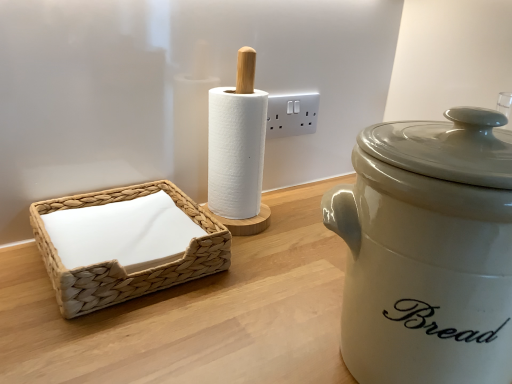
Question: In the image, is woven beige basket at left positioned in front of or behind white plastic electric outlet at upper center?

Choices:
 (A) front
 (B) behind

Answer: (A)

Question: In terms of height, does woven beige basket at left look taller or shorter compared to white plastic electric outlet at upper center?

Choices:
 (A) short
 (B) tall

Answer: (A)

Question: Which object is positioned farthest from the woven beige basket at left?

Choices:
 (A) white plastic electric outlet at upper center
 (B) matte white ceramic bread bin at right

Answer: (A)

Question: Considering the real-world distances, which object is farthest from the white plastic electric outlet at upper center?

Choices:
 (A) woven beige basket at left
 (B) matte white ceramic bread bin at right

Answer: (B)